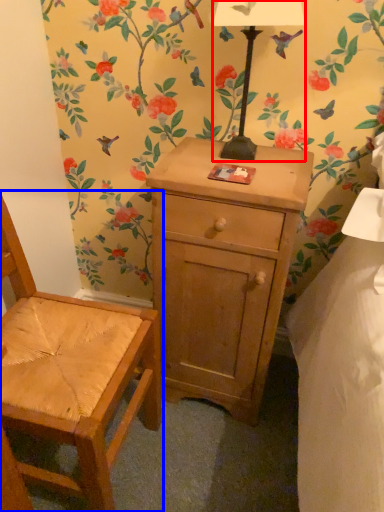
Question: Among these objects, which one is nearest to the camera, lamp (highlighted by a red box) or chair (highlighted by a blue box)?

Choices:
 (A) lamp
 (B) chair

Answer: (B)